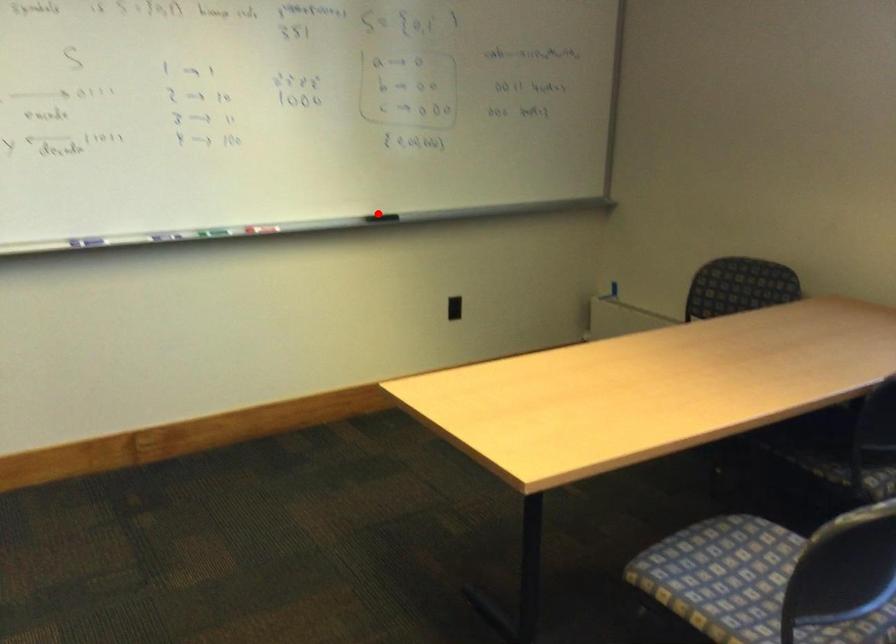
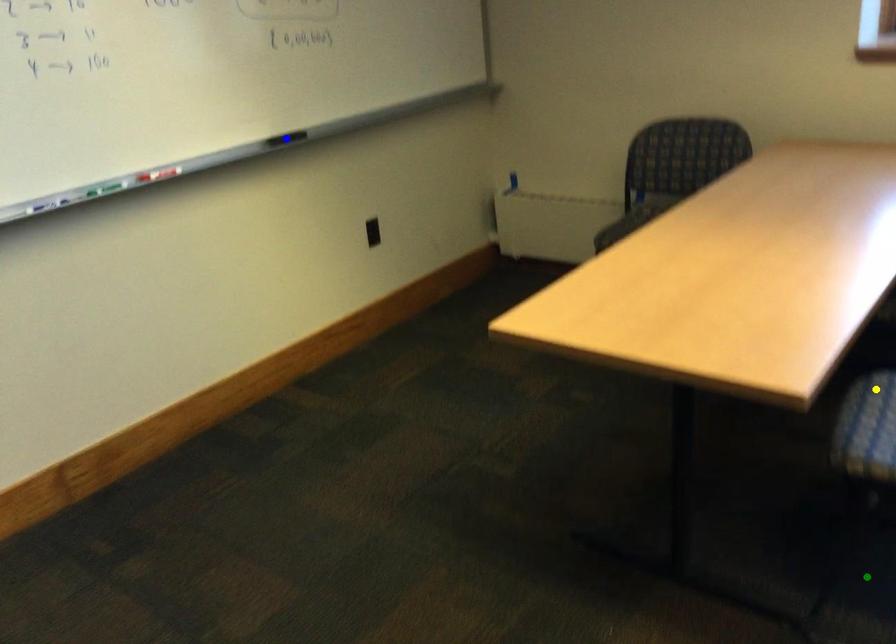
Question: I am providing you with two images of the same scene from different viewpoints. A red point is marked on the first image. You are given multiple points on the second image. Which point in image 2 represents the same 3d spot as the red point in image 1?

Choices:
 (A) yellow point
 (B) green point
 (C) blue point

Answer: (C)